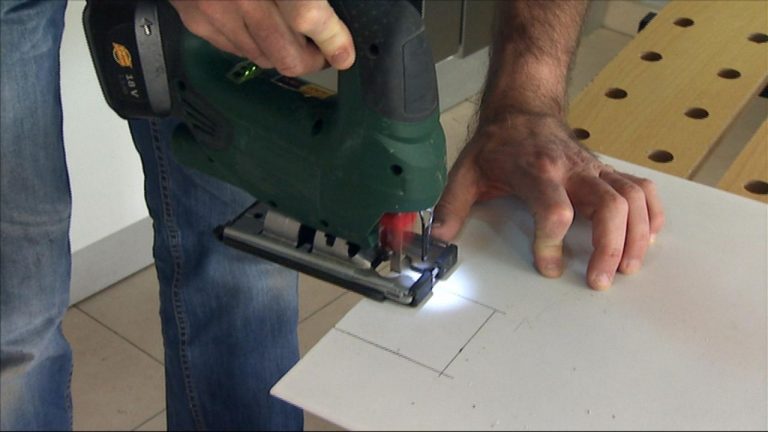
At what (x,y) coordinates should I click in order to perform the action: click on white board. Please return your answer as a coordinate pair (x, y). Looking at the image, I should click on (525, 390).